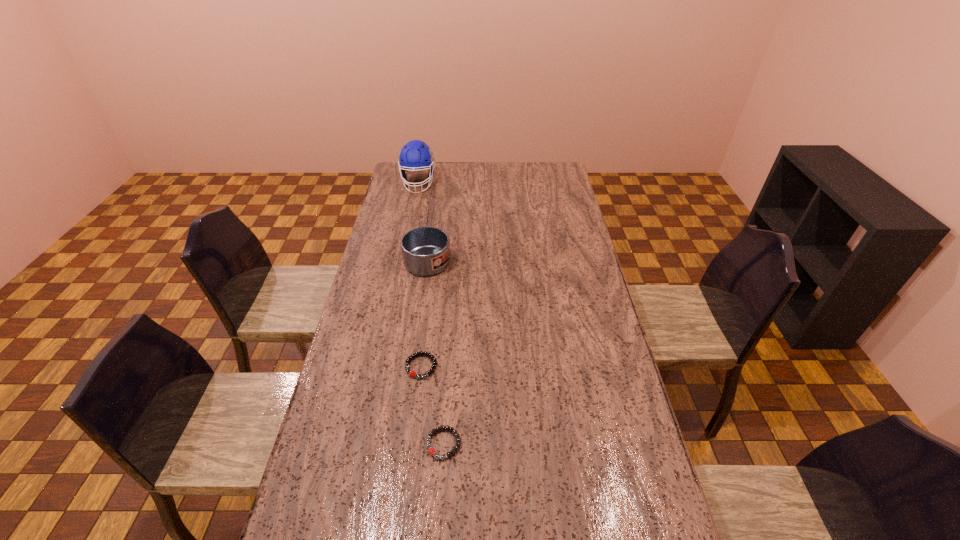
At what (x,y) coordinates should I click in order to perform the action: click on vacant point located between the saucepan and the second nearest object. Please return your answer as a coordinate pair (x, y). Looking at the image, I should click on (425, 305).

Where is `empty space between the farther bracelet and the nearer bracelet`? This screenshot has width=960, height=540. empty space between the farther bracelet and the nearer bracelet is located at coordinates (432, 405).

This screenshot has width=960, height=540. Find the location of `empty space that is in between the second nearest object and the saucepan`. empty space that is in between the second nearest object and the saucepan is located at coordinates (425, 305).

What are the coordinates of `vacant area between the nearer bracelet and the farther bracelet` in the screenshot? It's located at coord(432,405).

Identify which object is the nearest to the third nearest object. Please provide its 2D coordinates. Your answer should be formatted as a tuple, i.e. [(x, y)], where the tuple contains the x and y coordinates of a point satisfying the conditions above.

[(416, 155)]

At what (x,y) coordinates should I click in order to perform the action: click on object that is the second nearest to the nearest object. Please return your answer as a coordinate pair (x, y). This screenshot has height=540, width=960. Looking at the image, I should click on (426, 250).

Identify which bracelet is located as the second nearest to the third shortest object. Please provide its 2D coordinates. Your answer should be formatted as a tuple, i.e. [(x, y)], where the tuple contains the x and y coordinates of a point satisfying the conditions above.

[(432, 451)]

The width and height of the screenshot is (960, 540). I want to click on the closest bracelet to the second farthest object, so click(x=412, y=373).

Locate an element on the screen. This screenshot has height=540, width=960. vacant space that satisfies the following two spatial constraints: 1. on the face guard of the second nearest object; 2. on the left side of the farthest object is located at coordinates (381, 367).

In order to click on free space that satisfies the following two spatial constraints: 1. on the face guard of the football helmet; 2. on the right side of the farther bracelet in this screenshot , I will do `click(381, 367)`.